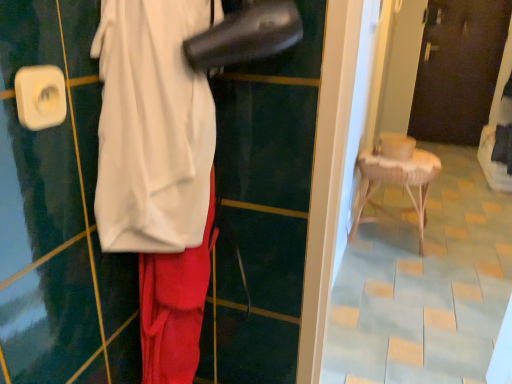
Where is `woven wood stool at right`? woven wood stool at right is located at coordinates (396, 182).

Locate an element on the screen. This screenshot has width=512, height=384. dark brown wooden door at upper center is located at coordinates (458, 69).

Considering the points (433, 166) and (452, 122), which point is in front, point (433, 166) or point (452, 122)?

The point (433, 166) is closer.

From the image's perspective, which object appears higher, woven wood stool at right or dark brown wooden door at upper center?

From the image's view, dark brown wooden door at upper center is above.

From a real-world perspective, which is physically above, woven wood stool at right or dark brown wooden door at upper center?

From a 3D spatial view, dark brown wooden door at upper center is above.

How many degrees apart are the facing directions of dark brown wooden door at upper center and woven wood stool at right?

There is a 89.1-degree angle between the facing directions of dark brown wooden door at upper center and woven wood stool at right.

Based on their positions, is dark brown wooden door at upper center located to the left or right of woven wood stool at right?

dark brown wooden door at upper center is to the right of woven wood stool at right.

From a real-world perspective, which object rests below the other?

woven wood stool at right.

Is dark brown wooden door at upper center surrounding woven wood stool at right?

Actually, woven wood stool at right is outside dark brown wooden door at upper center.

Can you confirm if dark brown wooden door at upper center is wider than white fabric at center?

No, dark brown wooden door at upper center is not wider than white fabric at center.

Looking at this image, from a real-world perspective, is dark brown wooden door at upper center positioned above or below white fabric at center?

In terms of real-world spatial position, dark brown wooden door at upper center is below white fabric at center.

Can you confirm if dark brown wooden door at upper center is bigger than white fabric at center?

Indeed, dark brown wooden door at upper center has a larger size compared to white fabric at center.

Is dark brown wooden door at upper center located outside white fabric at center?

dark brown wooden door at upper center lies outside white fabric at center's area.

How far apart are white fabric at center and woven wood stool at right?

white fabric at center is 6.97 feet from woven wood stool at right.

From a real-world perspective, which is physically above, white fabric at center or woven wood stool at right?

white fabric at center.

Is white fabric at center next to woven wood stool at right and touching it?

There is a gap between white fabric at center and woven wood stool at right.

Between point (106, 63) and point (367, 159), which one is positioned in front?

Positioned in front is point (106, 63).

Could white fabric at center be considered to be inside woven wood stool at right?

No.

Based on the photo, from the image's perspective, between woven wood stool at right and white fabric at center, who is located below?

woven wood stool at right is shown below in the image.

Looking at this image, relative to white fabric at center, is woven wood stool at right in front or behind?

Visually, woven wood stool at right is located behind white fabric at center.

Is white fabric at center at the back of woven wood stool at right?

woven wood stool at right is not turned away from white fabric at center.

Is white fabric at center situated inside dark brown wooden door at upper center or outside?

white fabric at center lies outside dark brown wooden door at upper center.

You are a GUI agent. You are given a task and a screenshot of the screen. Output one action in this format:
    pyautogui.click(x=<x>, y=<y>)
    Task: Click on the wide on the left of dark brown wooden door at upper center
    The width and height of the screenshot is (512, 384).
    Given the screenshot: What is the action you would take?
    pyautogui.click(x=152, y=127)

From a real-world perspective, is white fabric at center above or below dark brown wooden door at upper center?

In terms of real-world spatial position, white fabric at center is above dark brown wooden door at upper center.

You are a GUI agent. You are given a task and a screenshot of the screen. Output one action in this format:
    pyautogui.click(x=<x>, y=<y>)
    Task: Click on the door behind the woven wood stool at right
    The height and width of the screenshot is (384, 512).
    Given the screenshot: What is the action you would take?
    pyautogui.click(x=458, y=69)

Find the location of a particular element. This screenshot has width=512, height=384. door above the woven wood stool at right (from the image's perspective) is located at coordinates (458, 69).

Looking at the image, which one is located further to white fabric at center, dark brown wooden door at upper center or woven wood stool at right?

dark brown wooden door at upper center lies further to white fabric at center than the other object.

Looking at the image, which one is located closer to white fabric at center, woven wood stool at right or dark brown wooden door at upper center?

woven wood stool at right lies closer to white fabric at center than the other object.

Which object lies further to the anchor point dark brown wooden door at upper center, white fabric at center or woven wood stool at right?

white fabric at center is further to dark brown wooden door at upper center.

Estimate the real-world distances between objects in this image. Which object is further from dark brown wooden door at upper center, woven wood stool at right or white fabric at center?

Among the two, white fabric at center is located further to dark brown wooden door at upper center.

Considering their positions, is white fabric at center positioned further to woven wood stool at right than dark brown wooden door at upper center?

dark brown wooden door at upper center lies further to woven wood stool at right than the other object.

From the image, which object appears to be nearer to woven wood stool at right, dark brown wooden door at upper center or white fabric at center?

Based on the image, white fabric at center appears to be nearer to woven wood stool at right.

Find the location of a particular element. Image resolution: width=512 pixels, height=384 pixels. furniture between white fabric at center and dark brown wooden door at upper center from front to back is located at coordinates (396, 182).